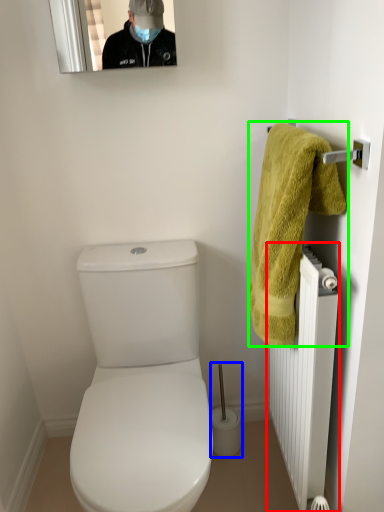
Question: Which is nearer to the radiator (highlighted by a red box)? brush (highlighted by a blue box) or towel (highlighted by a green box).

Choices:
 (A) brush
 (B) towel

Answer: (B)